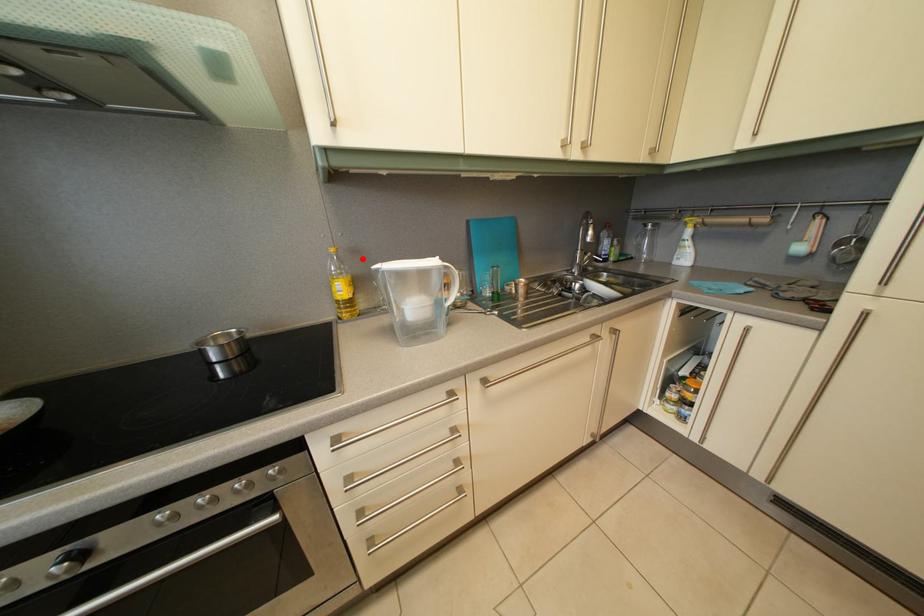
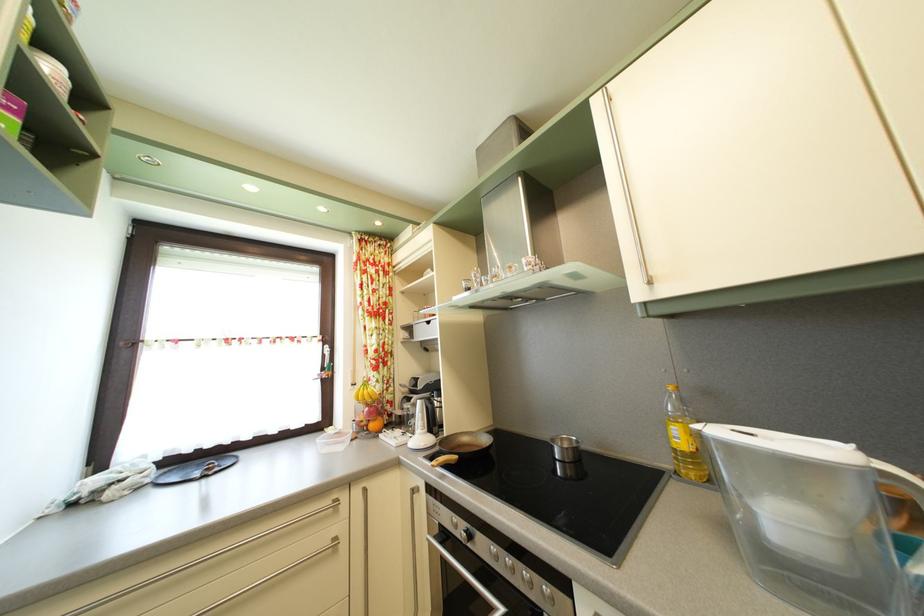
Locate, in the second image, the point that corresponds to the highlighted location in the first image.

(715, 400)